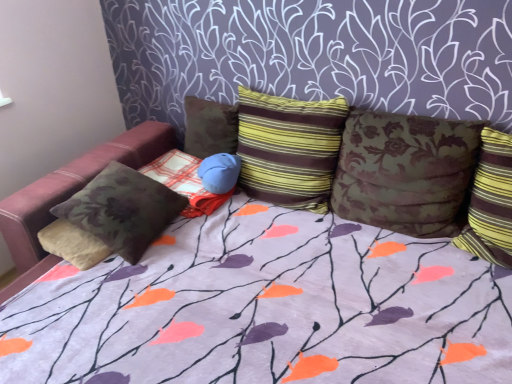
Question: Should I look upward or downward to see brown floral pillow at center, which appears as the third pillow when viewed from the left?

Choices:
 (A) up
 (B) down

Answer: (A)

Question: Considering the relative sizes of velvet floral pillow at left, which is counted as the sixth pillow, starting from the right, and brown floral fabric bean bag chair at left in the image provided, is velvet floral pillow at left, which is counted as the sixth pillow, starting from the right, smaller than brown floral fabric bean bag chair at left?

Choices:
 (A) yes
 (B) no

Answer: (A)

Question: Is velvet floral pillow at left, which is counted as the sixth pillow, starting from the right, not close to brown floral fabric bean bag chair at left?

Choices:
 (A) yes
 (B) no

Answer: (B)

Question: Considering the relative positions of velvet floral pillow at left, which is counted as the sixth pillow, starting from the right, and brown floral fabric bean bag chair at left in the image provided, is velvet floral pillow at left, which is counted as the sixth pillow, starting from the right, to the right of brown floral fabric bean bag chair at left from the viewer's perspective?

Choices:
 (A) no
 (B) yes

Answer: (A)

Question: From the image's perspective, is velvet floral pillow at left, placed as the first pillow when sorted from left to right, under brown floral fabric bean bag chair at left?

Choices:
 (A) no
 (B) yes

Answer: (B)

Question: From a real-world perspective, is velvet floral pillow at left, which is counted as the sixth pillow, starting from the right, physically below brown floral fabric bean bag chair at left?

Choices:
 (A) yes
 (B) no

Answer: (A)

Question: From the image's perspective, is velvet floral pillow at left, which is counted as the sixth pillow, starting from the right, over brown floral fabric bean bag chair at left?

Choices:
 (A) no
 (B) yes

Answer: (A)

Question: Does brown floral fabric bean bag chair at left appear on the right side of velvety brown pillow at center, positioned as the 5th pillow in right-to-left order?

Choices:
 (A) yes
 (B) no

Answer: (B)

Question: Can you confirm if brown floral fabric bean bag chair at left is shorter than velvety brown pillow at center, acting as the second pillow starting from the left?

Choices:
 (A) no
 (B) yes

Answer: (A)

Question: Is brown floral fabric bean bag chair at left positioned beyond the bounds of velvety brown pillow at center, positioned as the 5th pillow in right-to-left order?

Choices:
 (A) no
 (B) yes

Answer: (B)

Question: Is brown floral fabric bean bag chair at left closer to the viewer compared to velvety brown pillow at center, acting as the second pillow starting from the left?

Choices:
 (A) yes
 (B) no

Answer: (A)

Question: Is brown floral fabric bean bag chair at left beside velvety brown pillow at center, acting as the second pillow starting from the left?

Choices:
 (A) yes
 (B) no

Answer: (B)

Question: Is velvety brown pillow at center, positioned as the 5th pillow in right-to-left order, surrounded by brown floral fabric bean bag chair at left?

Choices:
 (A) no
 (B) yes

Answer: (A)

Question: Can you confirm if brown floral fabric bean bag chair at left is shorter than striped fabric pillow at right, the first pillow viewed from the right?

Choices:
 (A) yes
 (B) no

Answer: (A)